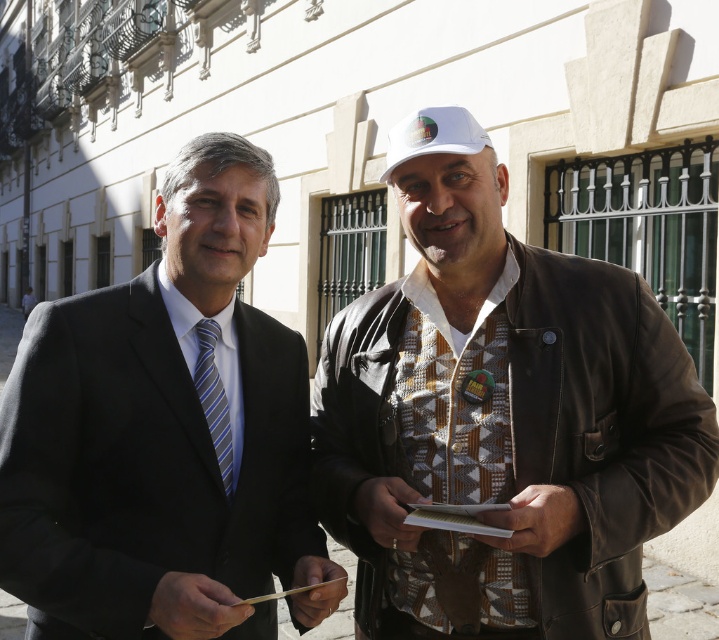
Question: Which object is positioned closest to the white matte baseball cap at upper center?

Choices:
 (A) wooden clipboard at center
 (B) blue striped tie at left

Answer: (B)

Question: Is brown leather jacket at right further to the viewer compared to white matte baseball cap at upper center?

Choices:
 (A) no
 (B) yes

Answer: (A)

Question: Which point is closer to the camera?

Choices:
 (A) (198, 346)
 (B) (116, 308)
 (C) (434, 253)

Answer: (B)

Question: Estimate the real-world distances between objects in this image. Which object is farther from the matte black suit at center?

Choices:
 (A) blue striped tie at left
 (B) wooden clipboard at center
 (C) brown leather jacket at right

Answer: (B)

Question: Can you confirm if matte black suit at center is smaller than blue striped tie at left?

Choices:
 (A) yes
 (B) no

Answer: (B)

Question: Can you confirm if white matte baseball cap at upper center is bigger than wooden clipboard at center?

Choices:
 (A) yes
 (B) no

Answer: (A)